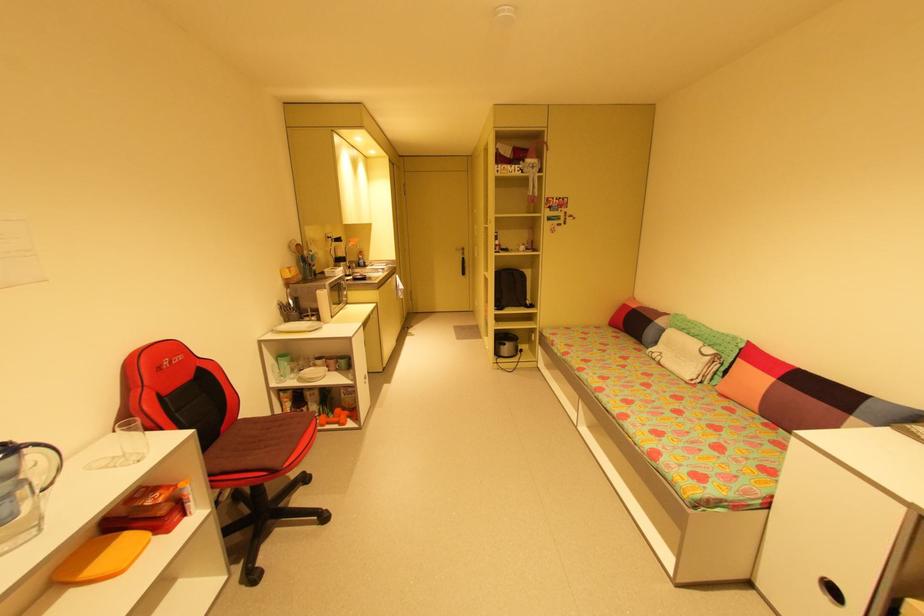
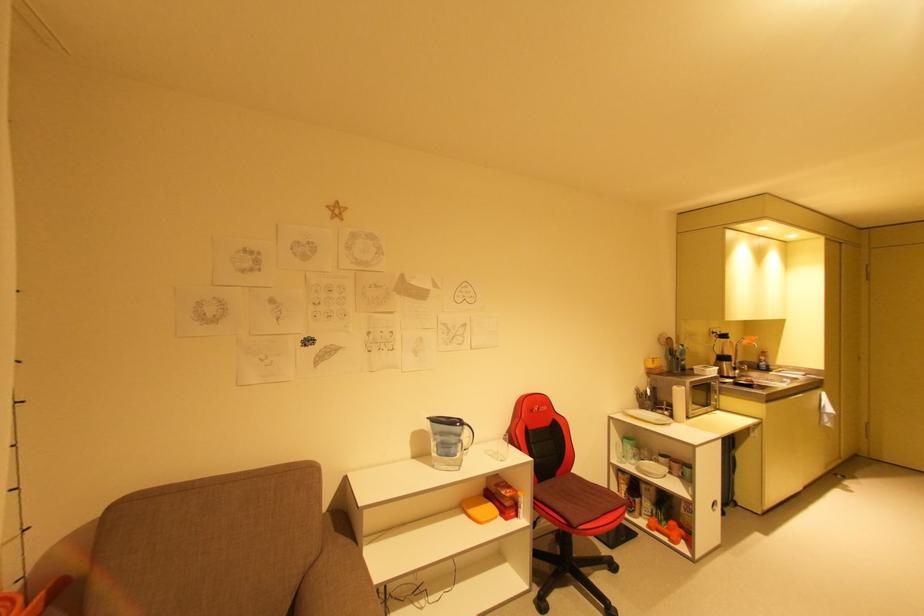
Locate, in the second image, the point that corresponds to [222,471] in the first image.

(544, 498)